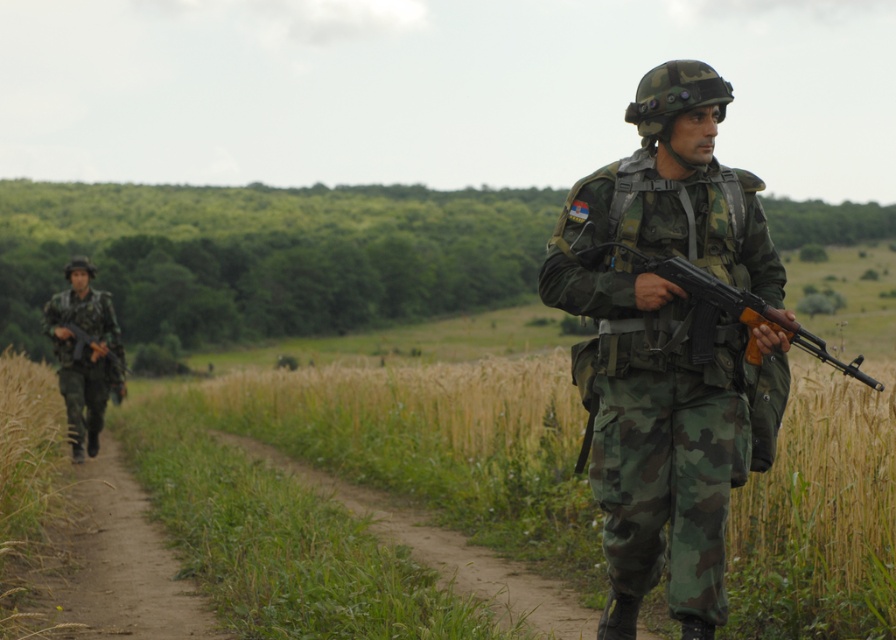
You are a drone operator observing the scene. You need to determine the relative position of the camo uniform at center and the matte black rifle at center. Which object is positioned lower in the image?

The camo uniform at center is located below matte black rifle at center, so the camo uniform at center is positioned lower in the image.

What are the coordinates of the camo uniform at center in the image?

The coordinates of the camo uniform at center are at point (670, 348).

You are a drone operator controlling a drone that needs to capture a closeup of the camo uniform at center. The drone is currently at point 0.5, 0.7. Should you move the drone north or south to get closer?

The camo uniform at center is located at point [670,348]. Since the drone is at [626,320], moving north would increase the y coordinate, so moving north would get closer to the uniform.